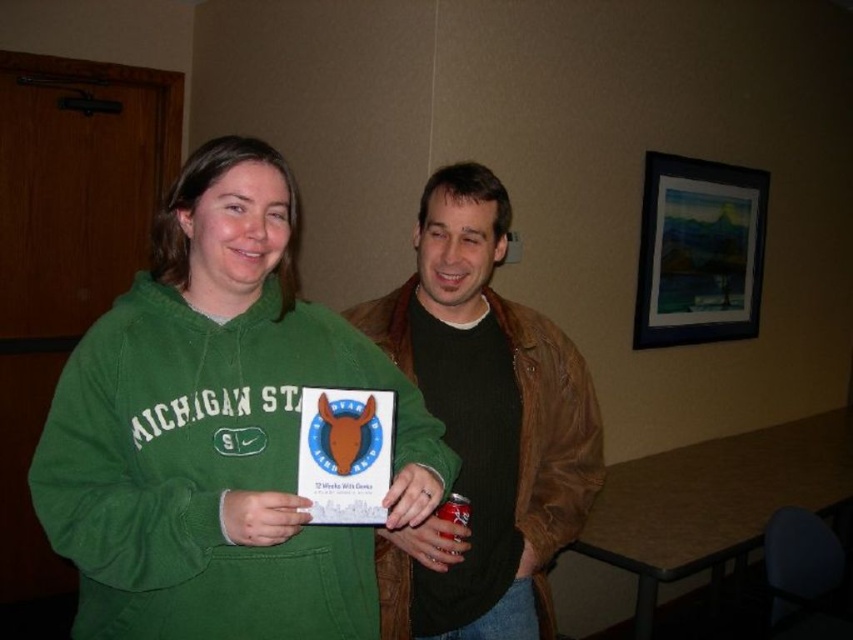
You are a tailor measuring two items of clothing for alterations. You have a green fleece sweatshirt at center and a brown leather jacket at center. Which item is shorter in height?

The green fleece sweatshirt at center has a lesser height compared to the brown leather jacket at center, so the green fleece sweatshirt at center is shorter in height.

You are organizing a charity clothing drive and need to pack these items into boxes. Given that the green fleece sweatshirt at center and the brown leather jacket at center are both folded neatly, which item will require a smaller box?

The green fleece sweatshirt at center occupies less space than the brown leather jacket at center, so it will require a smaller box.